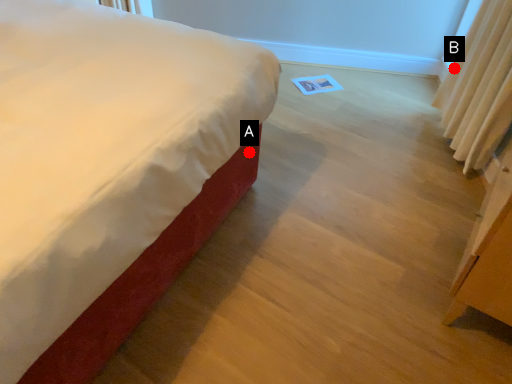
Question: Two points are circled on the image, labeled by A and B beside each circle. Which of the following is the farthest from the observer?

Choices:
 (A) A is further
 (B) B is further

Answer: (B)